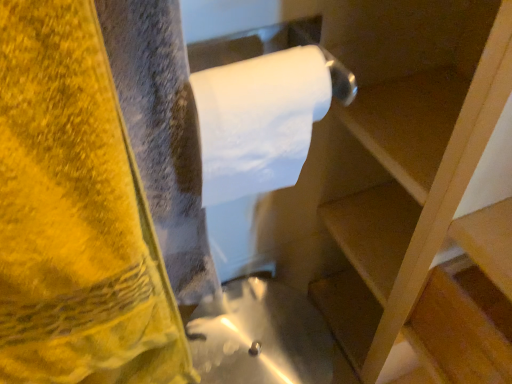
Question: Should I look upward or downward to see wooden at upper right?

Choices:
 (A) up
 (B) down

Answer: (B)

Question: Is yellow velvety towel at left smaller than wooden at upper right?

Choices:
 (A) yes
 (B) no

Answer: (A)

Question: Considering the relative sizes of yellow velvety towel at left and wooden at upper right in the image provided, is yellow velvety towel at left wider than wooden at upper right?

Choices:
 (A) no
 (B) yes

Answer: (A)

Question: Is yellow velvety towel at left positioned before wooden at upper right?

Choices:
 (A) no
 (B) yes

Answer: (A)

Question: Does yellow velvety towel at left appear on the right side of wooden at upper right?

Choices:
 (A) no
 (B) yes

Answer: (A)

Question: Is yellow velvety towel at left thinner than wooden at upper right?

Choices:
 (A) no
 (B) yes

Answer: (B)

Question: Could you tell me if yellow velvety towel at left is turned towards wooden at upper right?

Choices:
 (A) no
 (B) yes

Answer: (A)

Question: Is wooden at upper right wider than white matte toilet paper at upper center?

Choices:
 (A) no
 (B) yes

Answer: (B)

Question: Would you say white matte toilet paper at upper center is part of wooden at upper right's contents?

Choices:
 (A) yes
 (B) no

Answer: (B)

Question: Is wooden at upper right looking in the opposite direction of white matte toilet paper at upper center?

Choices:
 (A) no
 (B) yes

Answer: (A)

Question: Is wooden at upper right not inside white matte toilet paper at upper center?

Choices:
 (A) yes
 (B) no

Answer: (A)

Question: From the image's perspective, does wooden at upper right appear higher than white matte toilet paper at upper center?

Choices:
 (A) no
 (B) yes

Answer: (A)

Question: Is wooden at upper right taller than white matte toilet paper at upper center?

Choices:
 (A) yes
 (B) no

Answer: (A)

Question: Is yellow velvety towel at left shorter than white matte toilet paper at upper center?

Choices:
 (A) no
 (B) yes

Answer: (A)